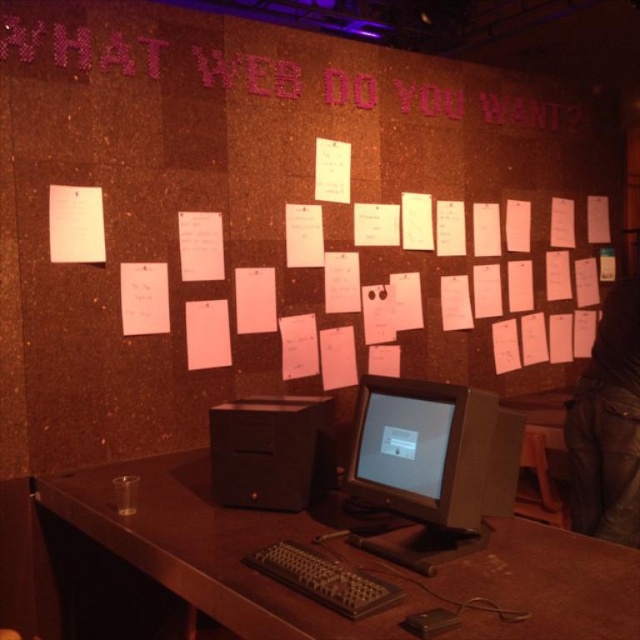
Looking at this image, you are a visitor standing in front of the exhibit and want to type on the black plastic keyboard at lower center. To reach it, you need to move around the brown wooden table at center. Which direction should you move relative to the table?

The brown wooden table at center is to the left of the black plastic keyboard at lower center, so you should move to the right of the table to reach the keyboard.

You are a visitor standing in front of the desk with the matte black monitor at center and the leather jacket at lower right. Which object is nearer to you?

The matte black monitor at center is closer to the viewer than the leather jacket at lower right.

You are standing in front of the brown wooden table at center and the black plastic keyboard at lower center. Which object is nearer to you?

The brown wooden table at center is closer to the viewer than the black plastic keyboard at lower center, so the brown wooden table at center is nearer to you.